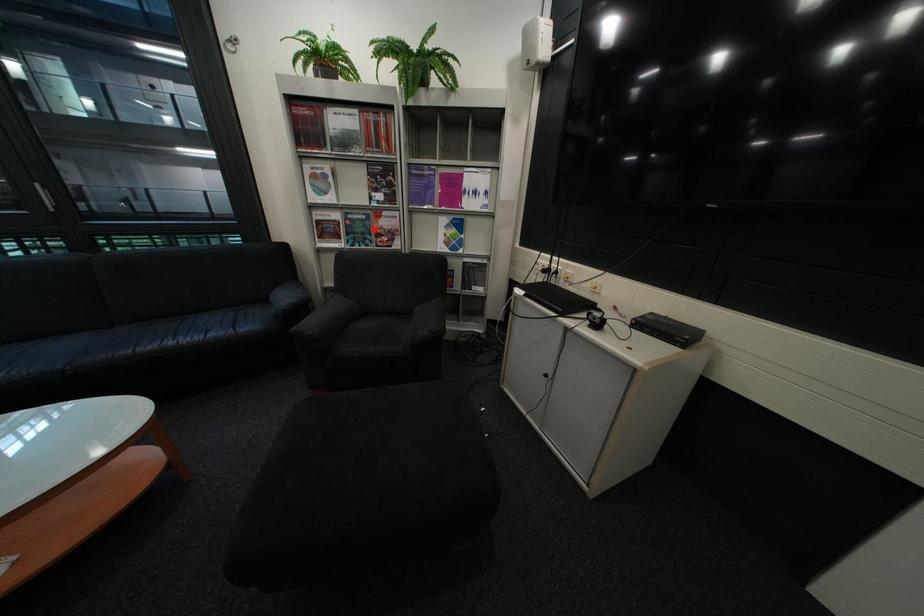
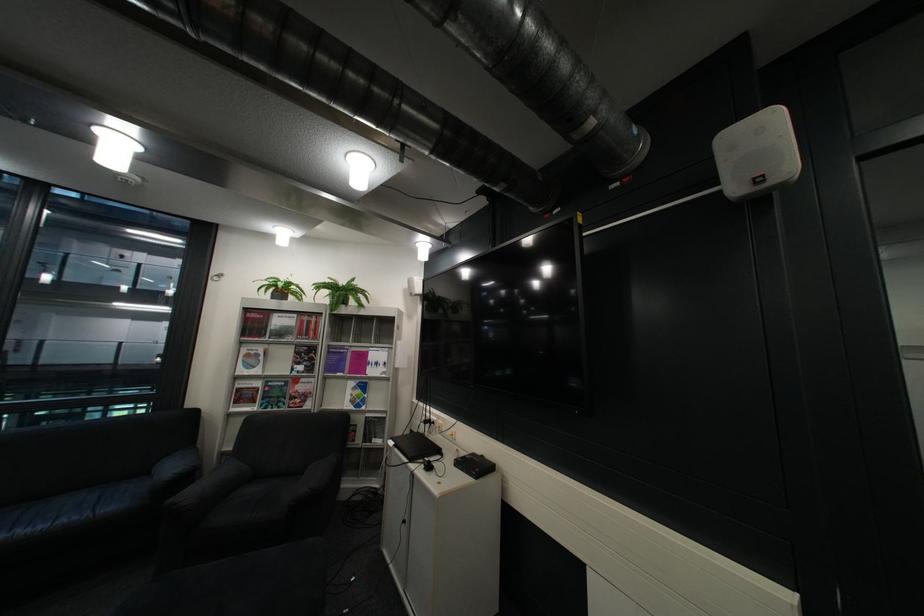
Question: I am providing you with two images of the same scene from different viewpoints. In image1, a red point is highlighted. Considering the same 3D point in image2, which of the following is correct?

Choices:
 (A) It is closer
 (B) It is farther

Answer: (B)